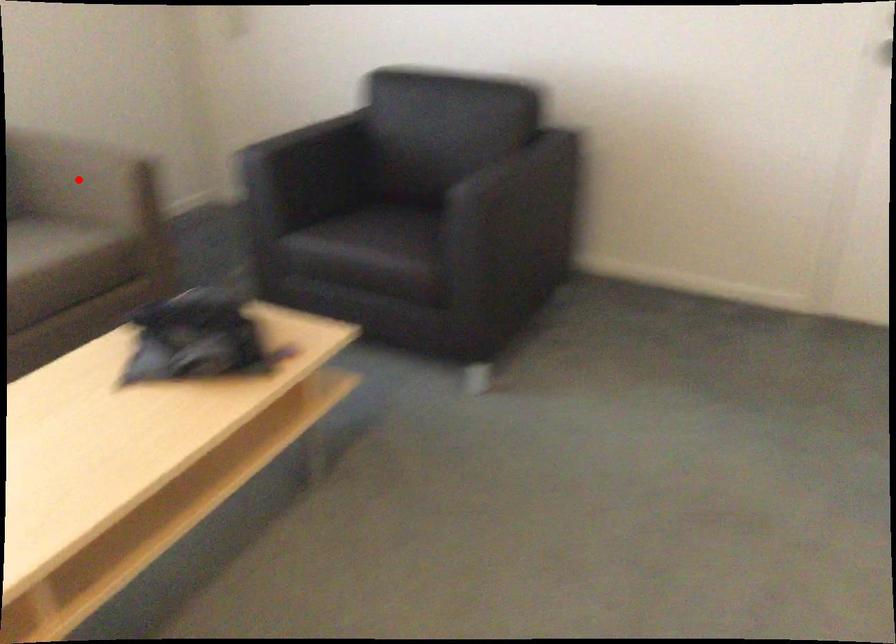
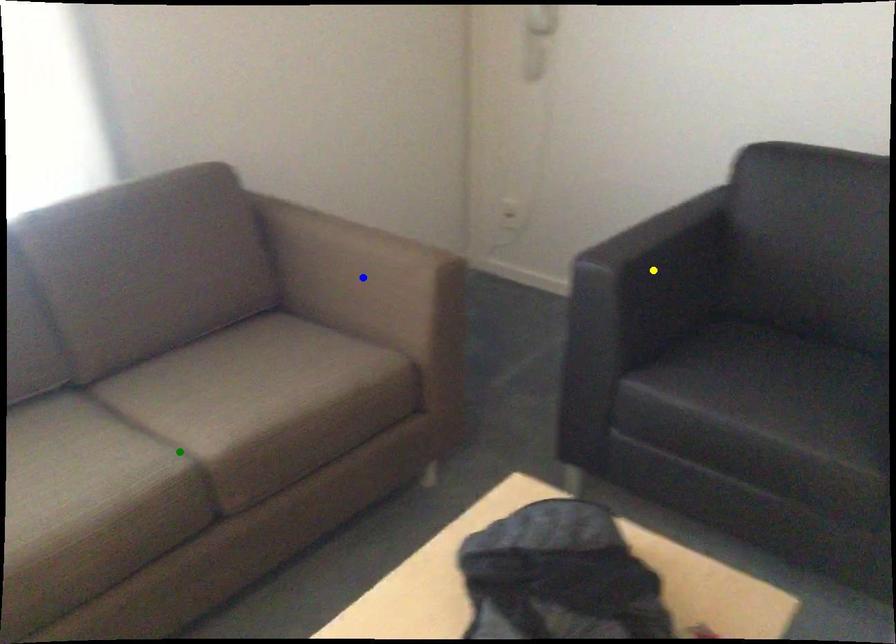
Question: I am providing you with two images of the same scene from different viewpoints. A red point is marked on the first image. You are given multiple points on the second image. Which spot in image 2 lines up with the point in image 1?

Choices:
 (A) yellow point
 (B) green point
 (C) blue point

Answer: (C)